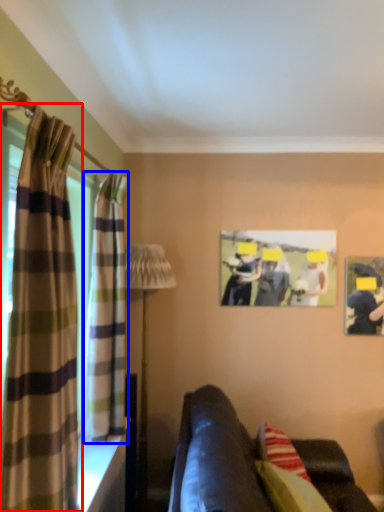
Question: Which object is closer to the camera taking this photo, curtain (highlighted by a red box) or curtain (highlighted by a blue box)?

Choices:
 (A) curtain
 (B) curtain

Answer: (A)